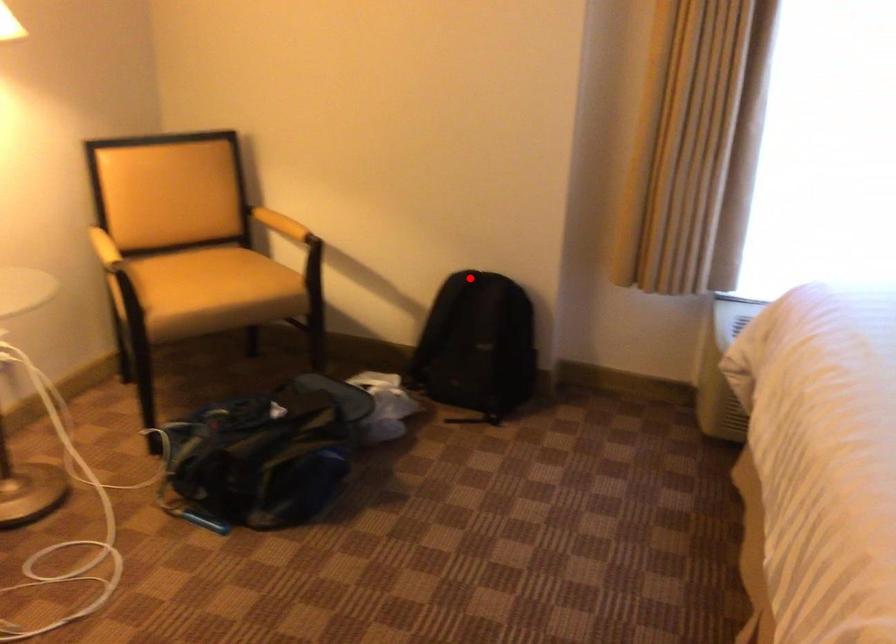
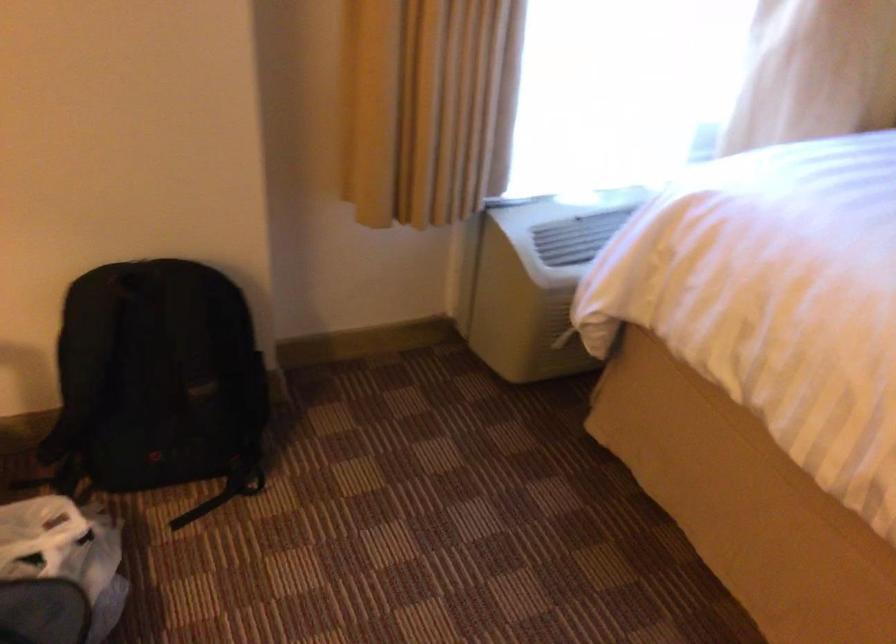
Question: I am providing you with two images of the same scene from different viewpoints. Image1 has a red point marked. In image2, the corresponding 3D location appears at what relative position? Reply with the corresponding letter.

Choices:
 (A) Closer
 (B) Farther

Answer: (A)